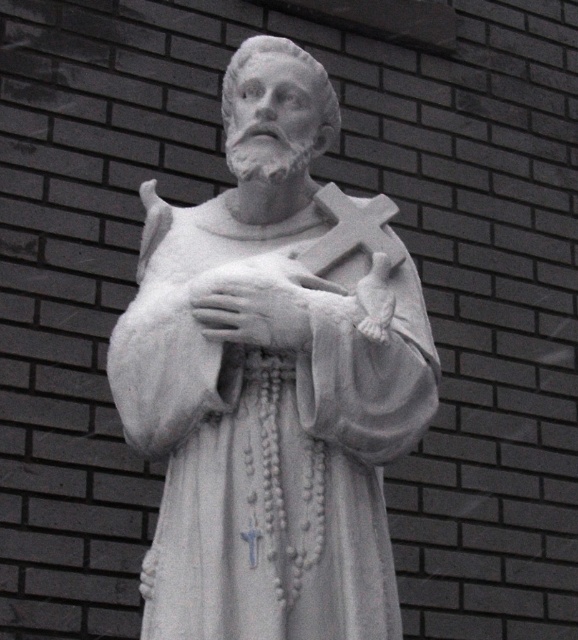
Question: Is the position of white marble statue at center more distant than that of white stone cross at center?

Choices:
 (A) no
 (B) yes

Answer: (A)

Question: Is white marble statue at center below white stone cross at center?

Choices:
 (A) yes
 (B) no

Answer: (A)

Question: Which point is farther to the camera?

Choices:
 (A) (265, 381)
 (B) (324, 196)

Answer: (B)

Question: Which object appears farthest from the camera in this image?

Choices:
 (A) white stone cross at center
 (B) white marble statue at center

Answer: (A)

Question: Does white marble statue at center lie behind white stone cross at center?

Choices:
 (A) no
 (B) yes

Answer: (A)